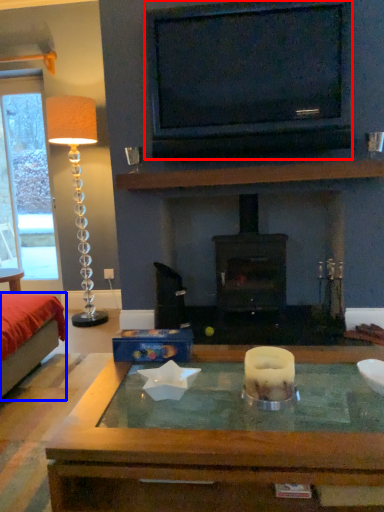
Question: Among these objects, which one is nearest to the camera, television (highlighted by a red box) or bed (highlighted by a blue box)?

Choices:
 (A) television
 (B) bed

Answer: (B)